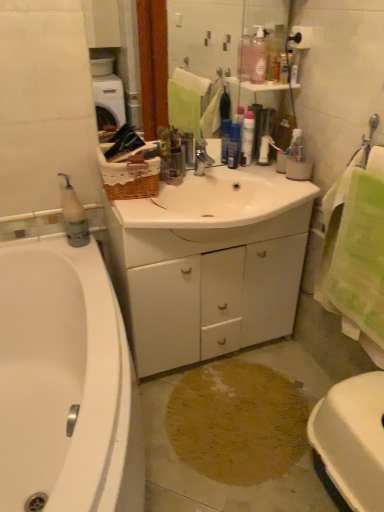
At what (x,y) coordinates should I click in order to perform the action: click on translucent plastic bottle at upper right, marked as the second toiletry in a back-to-front arrangement. Please return your answer as a coordinate pair (x, y). Looking at the image, I should click on (284, 68).

The height and width of the screenshot is (512, 384). What do you see at coordinates (66, 383) in the screenshot?
I see `white glossy bathtub at left` at bounding box center [66, 383].

Describe the element at coordinates (217, 200) in the screenshot. Image resolution: width=384 pixels, height=512 pixels. I see `white glossy sink at center` at that location.

What is the approximate width of white glossy sink at center?

It is 57.95 centimeters.

The image size is (384, 512). In order to click on translucent plastic bottle at upper right, the first toiletry when ordered from right to left in this screenshot , I will do `click(284, 68)`.

Is brown textured rug at center located outside white glossy bathtub at left?

Yes, brown textured rug at center is not within white glossy bathtub at left.

Based on the photo, considering the relative sizes of brown textured rug at center and white glossy bathtub at left in the image provided, is brown textured rug at center bigger than white glossy bathtub at left?

Incorrect, brown textured rug at center is not larger than white glossy bathtub at left.

Looking at this image, measure the distance between brown textured rug at center and white glossy bathtub at left.

brown textured rug at center is 23.73 inches from white glossy bathtub at left.

Is brown textured rug at center oriented away from white glossy bathtub at left?

brown textured rug at center does not have its back to white glossy bathtub at left.

Does brown textured rug at center have a larger size compared to white matte cabinet at center?

Actually, brown textured rug at center might be smaller than white matte cabinet at center.

From the image's perspective, which object appears higher, brown textured rug at center or white matte cabinet at center?

From the image's view, white matte cabinet at center is above.

Is brown textured rug at center to the right of white matte cabinet at center from the viewer's perspective?

Indeed, brown textured rug at center is positioned on the right side of white matte cabinet at center.

Do you think brown textured rug at center is within white matte cabinet at center, or outside of it?

brown textured rug at center is outside white matte cabinet at center.

Which is correct: silver metallic faucet at center is inside blue glossy spray can at center, which appears as the 2th toiletry when viewed from the front, or outside of it?

silver metallic faucet at center is spatially situated outside blue glossy spray can at center, which appears as the 2th toiletry when viewed from the front.

From the image's perspective, between silver metallic faucet at center and blue glossy spray can at center, the first toiletry positioned from the bottom, who is located below?

silver metallic faucet at center, from the image's perspective.

Would you consider silver metallic faucet at center to be distant from blue glossy spray can at center, acting as the second toiletry starting from the top?

They are positioned close to each other.

Identify the location of tap below the blue glossy spray can at center, the 2th toiletry from the right (from a real-world perspective). The image size is (384, 512). (202, 157).

Can you confirm if white matte cabinet at center is thinner than white plastic bottle at left, which ranks as the first cleaning product in bottom-to-top order?

In fact, white matte cabinet at center might be wider than white plastic bottle at left, which ranks as the first cleaning product in bottom-to-top order.

How many degrees apart are the facing directions of white matte cabinet at center and white plastic bottle at left, which ranks as the 2th cleaning product in right-to-left order?

There is a 2.27-degree angle between the facing directions of white matte cabinet at center and white plastic bottle at left, which ranks as the 2th cleaning product in right-to-left order.

Find the location of `cabinetry that appears in front of the white plastic bottle at left, which ranks as the 2th cleaning product in right-to-left order`. cabinetry that appears in front of the white plastic bottle at left, which ranks as the 2th cleaning product in right-to-left order is located at coordinates (206, 287).

Which is in front, point (186, 356) or point (74, 233)?

The point (74, 233) is more forward.

The height and width of the screenshot is (512, 384). I want to click on cleaning product that is the 2nd one when counting backward from the white glossy sink at center, so click(258, 57).

In the image, is white glossy sink at center positioned in front of or behind pink translucent bottle at upper center, positioned as the 1th cleaning product in right-to-left order?

Visually, white glossy sink at center is located in front of pink translucent bottle at upper center, positioned as the 1th cleaning product in right-to-left order.

Between white glossy sink at center and pink translucent bottle at upper center, which is the second cleaning product in bottom-to-top order, which one has larger width?

Wider between the two is white glossy sink at center.

Is point (274, 182) positioned behind point (251, 45)?

Yes, it is behind point (251, 45).

Can you confirm if white plastic bottle at left, which ranks as the first cleaning product in bottom-to-top order, is wider than white matte cabinet at center?

In fact, white plastic bottle at left, which ranks as the first cleaning product in bottom-to-top order, might be narrower than white matte cabinet at center.

Is white plastic bottle at left, which ranks as the first cleaning product in bottom-to-top order, not close to white matte cabinet at center?

No, white plastic bottle at left, which ranks as the first cleaning product in bottom-to-top order, is not far from white matte cabinet at center.

Between white plastic bottle at left, marked as the 2th cleaning product in a top-to-bottom arrangement, and white matte cabinet at center, which one is positioned behind?

white plastic bottle at left, marked as the 2th cleaning product in a top-to-bottom arrangement, is further away from the camera.

Would you say white plastic bottle at left, marked as the 2th cleaning product in a top-to-bottom arrangement, is inside or outside white matte cabinet at center?

white plastic bottle at left, marked as the 2th cleaning product in a top-to-bottom arrangement, is outside white matte cabinet at center.

Does pink translucent bottle at upper center, arranged as the 2th cleaning product when viewed from the left, appear on the left side of translucent plastic bottle at upper right, the second toiletry in the left-to-right sequence?

Yes.

In terms of height, does pink translucent bottle at upper center, positioned as the 1th cleaning product in right-to-left order, look taller or shorter compared to translucent plastic bottle at upper right, the second toiletry in the left-to-right sequence?

In the image, pink translucent bottle at upper center, positioned as the 1th cleaning product in right-to-left order, appears to be taller than translucent plastic bottle at upper right, the second toiletry in the left-to-right sequence.

Would you consider pink translucent bottle at upper center, which ranks as the first cleaning product in top-to-bottom order, to be distant from translucent plastic bottle at upper right, arranged as the first toiletry when viewed from the top?

No, pink translucent bottle at upper center, which ranks as the first cleaning product in top-to-bottom order, is in close proximity to translucent plastic bottle at upper right, arranged as the first toiletry when viewed from the top.

In order to click on stain that is below the white glossy bathtub at left (from the image's perspective) in this screenshot , I will do `click(237, 422)`.

The width and height of the screenshot is (384, 512). Identify the location of stain that appears below the white matte cabinet at center (from a real-world perspective). [237, 422].

From the image, which object appears to be farther from white glossy sink at center, silver metallic faucet at center or white plastic bottle at left, which ranks as the 2th cleaning product in right-to-left order?

white plastic bottle at left, which ranks as the 2th cleaning product in right-to-left order, lies further to white glossy sink at center than the other object.

Based on their spatial positions, is silver metallic faucet at center or white matte cabinet at center closer to translucent plastic bottle at upper right, arranged as the first toiletry when viewed from the top?

silver metallic faucet at center.

When comparing their distances from white matte cabinet at center, does pink translucent bottle at upper center, arranged as the 2th cleaning product when viewed from the left, or green terry cloth towel at right seem closer?

Among the two, green terry cloth towel at right is located nearer to white matte cabinet at center.

Based on their spatial positions, is white glossy toilet at lower right or silver metallic faucet at center further from blue glossy spray can at center, the 2th toiletry from the right?

The object further to blue glossy spray can at center, the 2th toiletry from the right, is white glossy toilet at lower right.

Considering their positions, is silver metallic faucet at center positioned further to white glossy toilet at lower right than white plastic bottle at left, which ranks as the 2th cleaning product in right-to-left order?

Among the two, white plastic bottle at left, which ranks as the 2th cleaning product in right-to-left order, is located further to white glossy toilet at lower right.

When comparing their distances from white plastic bottle at left, which ranks as the 2th cleaning product in right-to-left order, does translucent plastic bottle at upper right, marked as the second toiletry in a back-to-front arrangement, or white matte cabinet at center seem further?

Among the two, translucent plastic bottle at upper right, marked as the second toiletry in a back-to-front arrangement, is located further to white plastic bottle at left, which ranks as the 2th cleaning product in right-to-left order.

When comparing their distances from pink translucent bottle at upper center, positioned as the 1th cleaning product in right-to-left order, does white glossy bathtub at left or green terry cloth towel at right seem further?

white glossy bathtub at left lies further to pink translucent bottle at upper center, positioned as the 1th cleaning product in right-to-left order, than the other object.

From the image, which object appears to be nearer to brown textured rug at center, white matte cabinet at center or white glossy bathtub at left?

The object closer to brown textured rug at center is white matte cabinet at center.

Where is `toilet between silver metallic faucet at center and brown textured rug at center in the up-down direction`? Image resolution: width=384 pixels, height=512 pixels. toilet between silver metallic faucet at center and brown textured rug at center in the up-down direction is located at coordinates (352, 439).

At what (x,y) coordinates should I click in order to perform the action: click on tap located between green terry cloth towel at right and blue glossy spray can at center, which appears as the 2th toiletry when viewed from the front, in the depth direction. Please return your answer as a coordinate pair (x, y). The image size is (384, 512). Looking at the image, I should click on (202, 157).

You are a GUI agent. You are given a task and a screenshot of the screen. Output one action in this format:
    pyautogui.click(x=<x>, y=<y>)
    Task: Click on the cleaning product that lies between silver metallic faucet at center and brown textured rug at center from top to bottom
    The height and width of the screenshot is (512, 384).
    Given the screenshot: What is the action you would take?
    pyautogui.click(x=73, y=216)

Identify the location of bath towel between silver metallic faucet at center and white glossy toilet at lower right in the up-down direction. Image resolution: width=384 pixels, height=512 pixels. tap(355, 254).